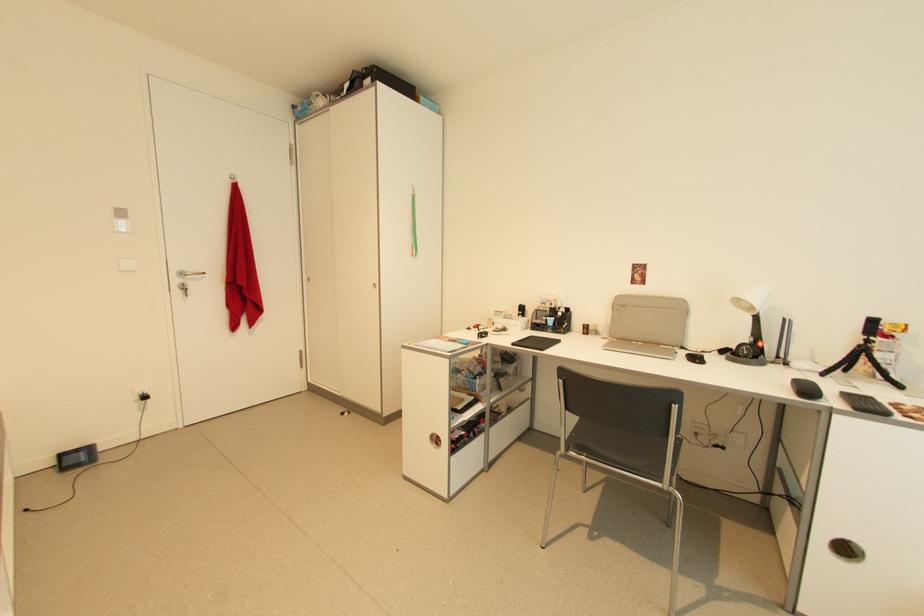
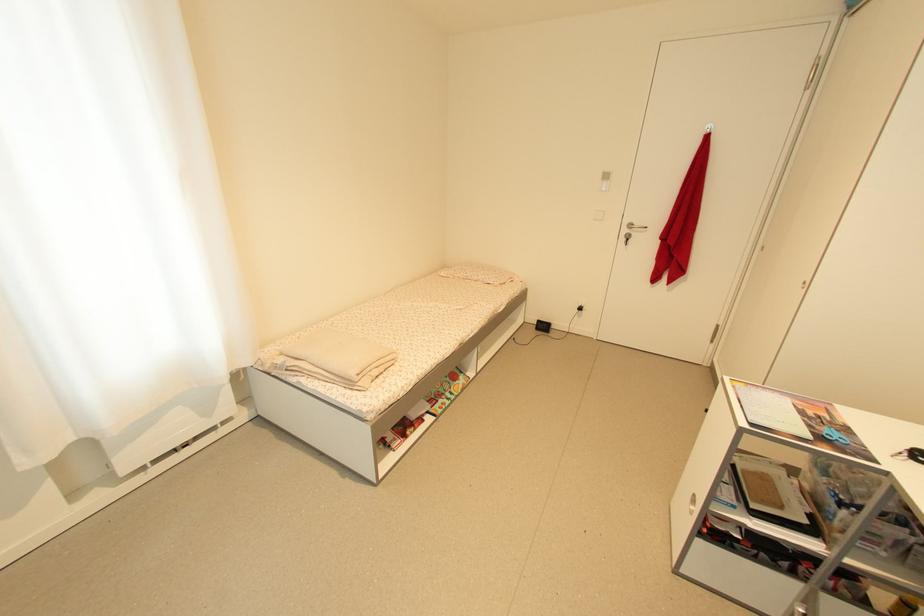
Where in the second image is the point corresponding to [187,276] from the first image?

(636, 227)